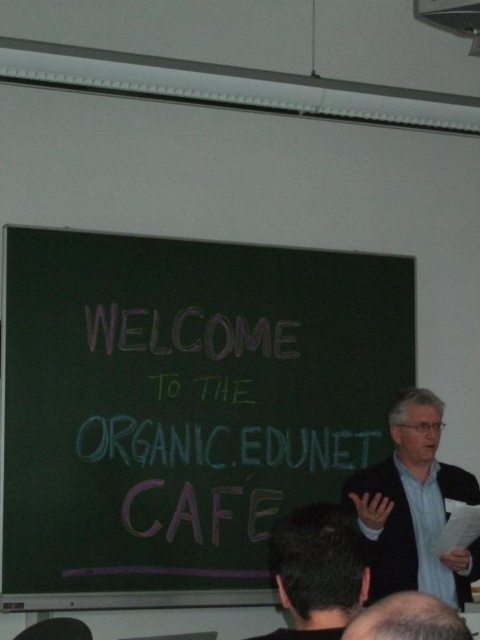
You are a student sitting in the classroom and you need to determine which object is larger between the light gray suit at right and the dark gray hair at upper center. Which one is bigger?

The light gray suit at right is bigger than the dark gray hair at upper center.

You are a student sitting in the classroom. You notice the chalkboard at center and the dark gray hair at lower center. Which object is taller?

The chalkboard at center is taller than the dark gray hair at lower center.